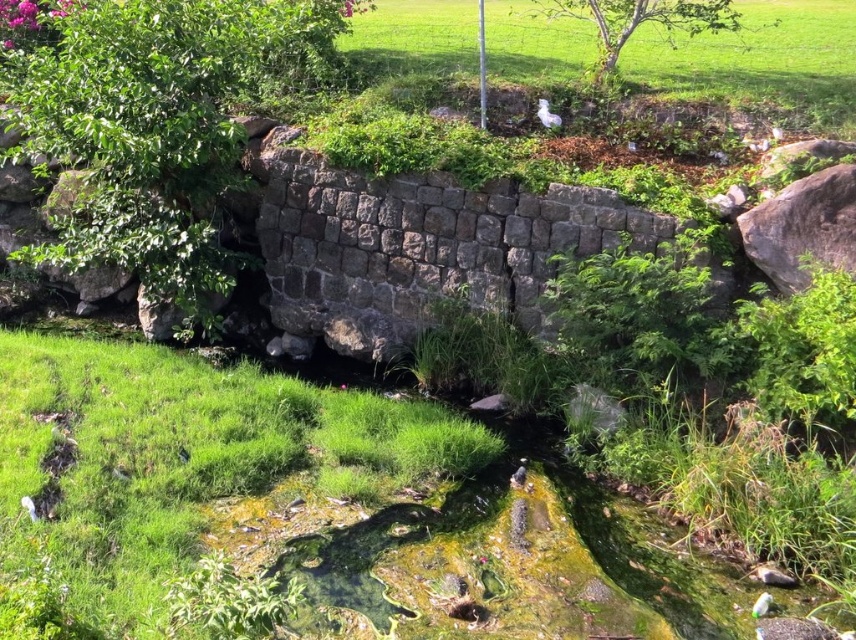
Is point (58, 483) farther from viewer compared to point (539, 115)?

No, it is in front of (539, 115).

Measure the distance between green grass at center and camera.

2.84 meters

Identify the location of green grass at center. This screenshot has height=640, width=856. (313, 509).